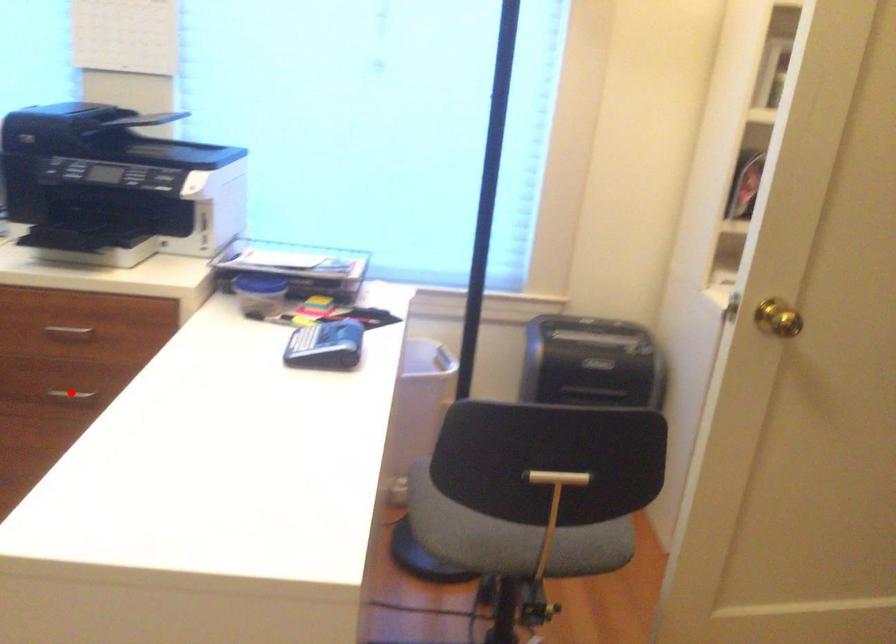
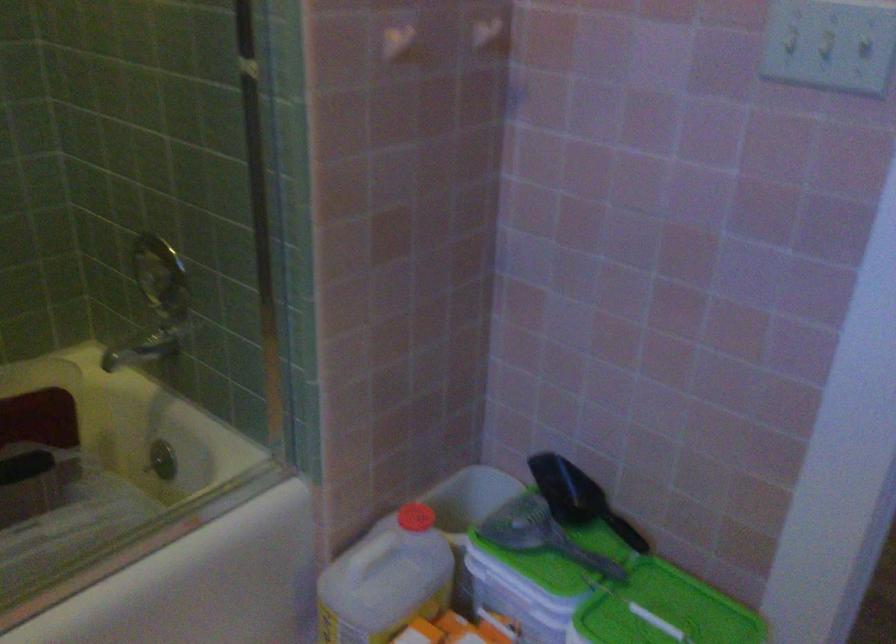
Question: I am providing you with two images of the same scene from different viewpoints. A red point is marked on the first image. At the location where the point appears in image 1, is it still visible in image 2?

Choices:
 (A) Yes
 (B) No

Answer: (B)